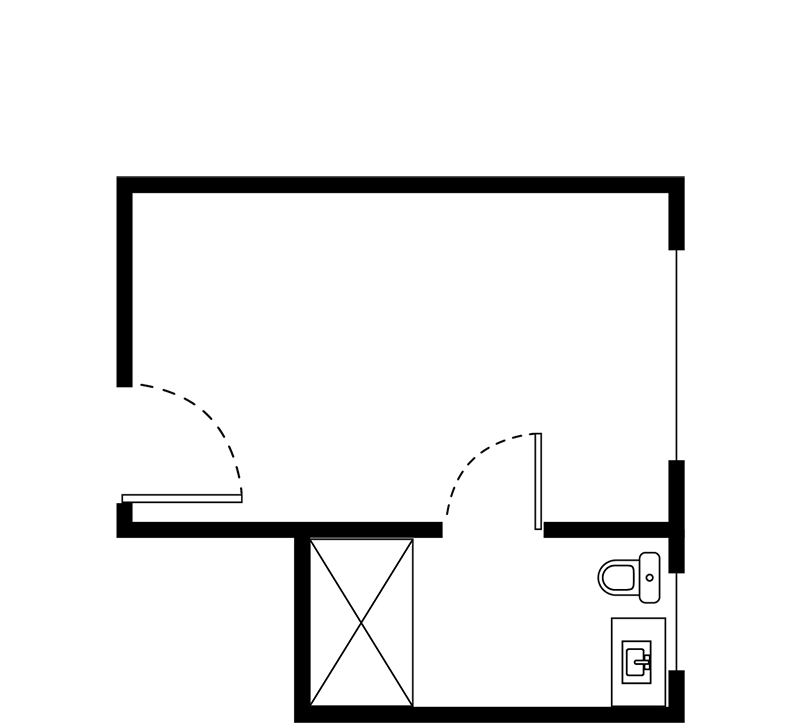
I want to click on window, so click(676, 623).